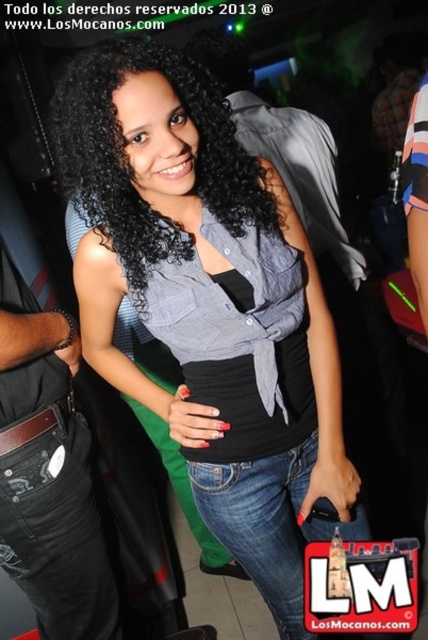
You are standing at the center of the room and see two points marked in the image. The first point is at coordinate point(285, 436) and the second point is at coordinate point(347, 280). Which point is closer to you?

Point(285, 436) is in front of point(347, 280), so it is closer to you.

In the image, there is a woman with black curly hair at center and a point at point [127,161]. Where is the black curly hair at center located?

The black curly hair at center is located at point [127,161].